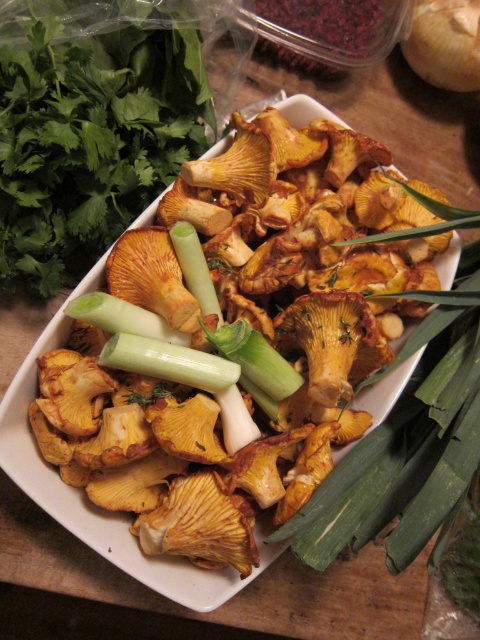
Is yellowish-brown textured mushrooms at center taller than green smooth/leathery scallion at center?

Yes, yellowish-brown textured mushrooms at center is taller than green smooth/leathery scallion at center.

Describe the element at coordinates (229, 332) in the screenshot. I see `yellowish-brown textured mushrooms at center` at that location.

Is point (52, 376) in front of point (24, 150)?

Yes, point (52, 376) is in front of point (24, 150).

Locate an element on the screen. yellowish-brown textured mushrooms at center is located at coordinates (229, 332).